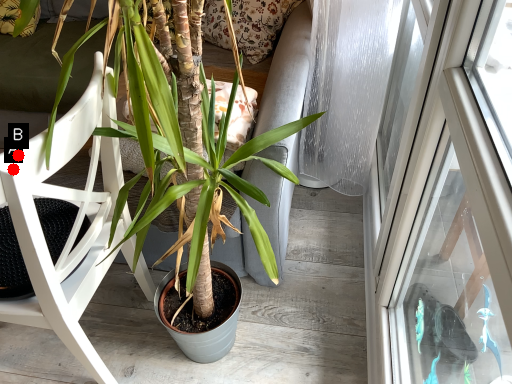
Question: Two points are circled on the image, labeled by A and B beside each circle. Which point is closer to the camera?

Choices:
 (A) A is closer
 (B) B is closer

Answer: (A)